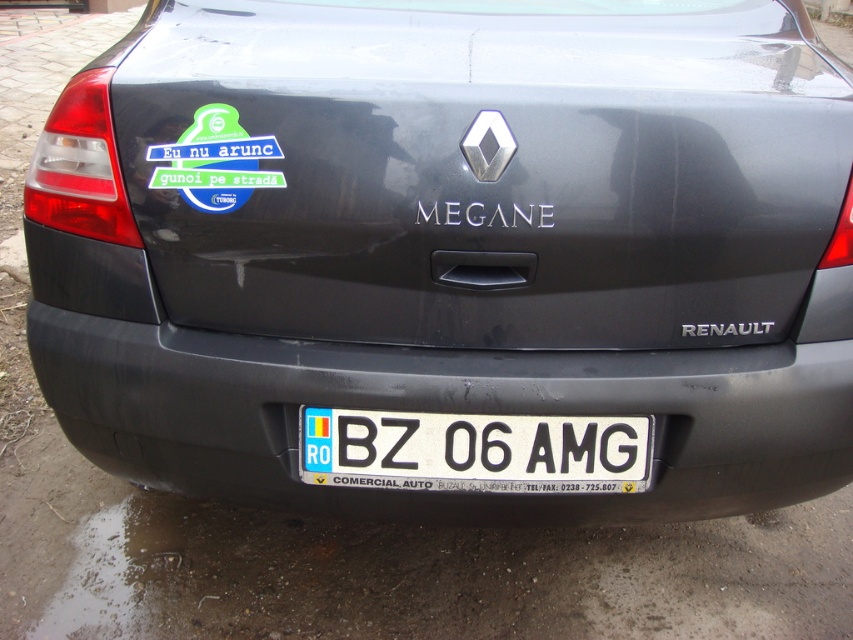
You are standing in front of the Renault Megane car and want to touch both points mentioned. Which point should you reach for first, the point at coordinates point (134, 404) or point (308, 424)?

You should reach for point (134, 404) first because it is closer to you than point (308, 424).

You are standing behind a Renault Megane car and notice the brown dirt at lower center and the white plastic license plate at center. Which object is positioned to the left of the other?

The brown dirt at lower center is to the left of the white plastic license plate at center.

You are a driver looking at the rear of the Renault Megane car. You notice the brown dirt at lower center and the white plastic license plate at center. Which object is closer to you?

The white plastic license plate at center is behind brown dirt at lower center, so the brown dirt at lower center is closer to you.